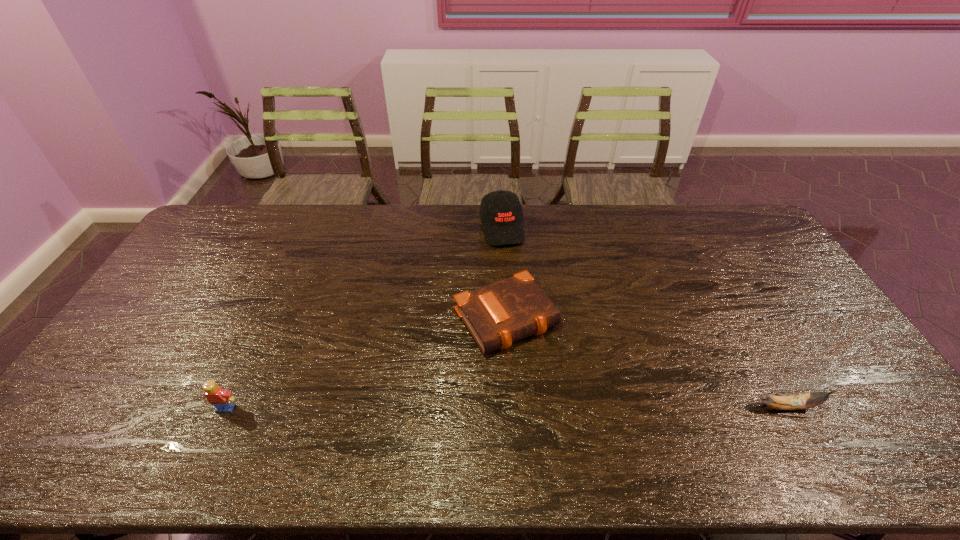
Find the location of a particular element. The image size is (960, 540). free spot on the desktop that is between the leftmost object and the third tallest object and is positioned on the front-facing side of the baseball cap is located at coordinates (551, 407).

This screenshot has height=540, width=960. What are the coordinates of `free space on the desktop that is between the Lego and the rightmost object and is positioned on the spine side of the shortest object` in the screenshot? It's located at (569, 407).